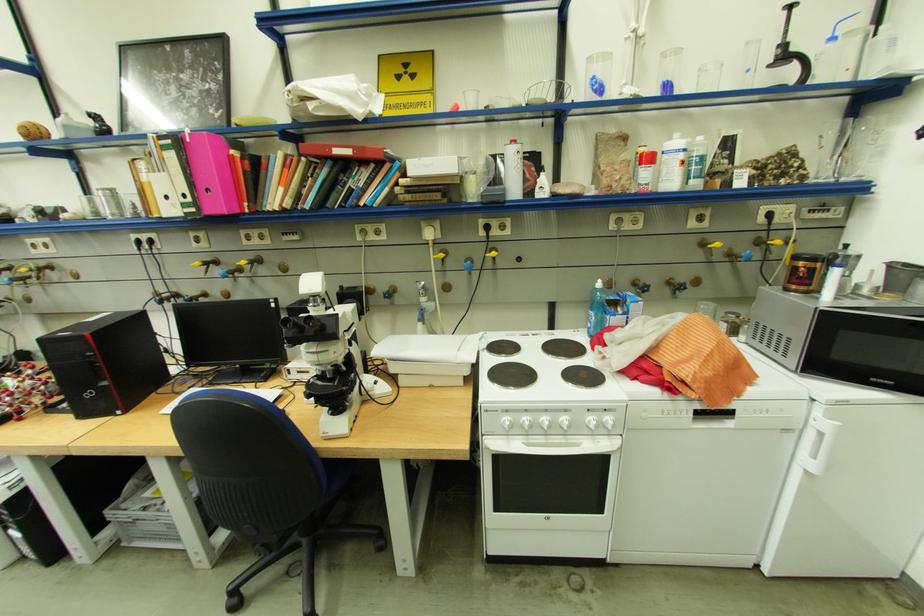
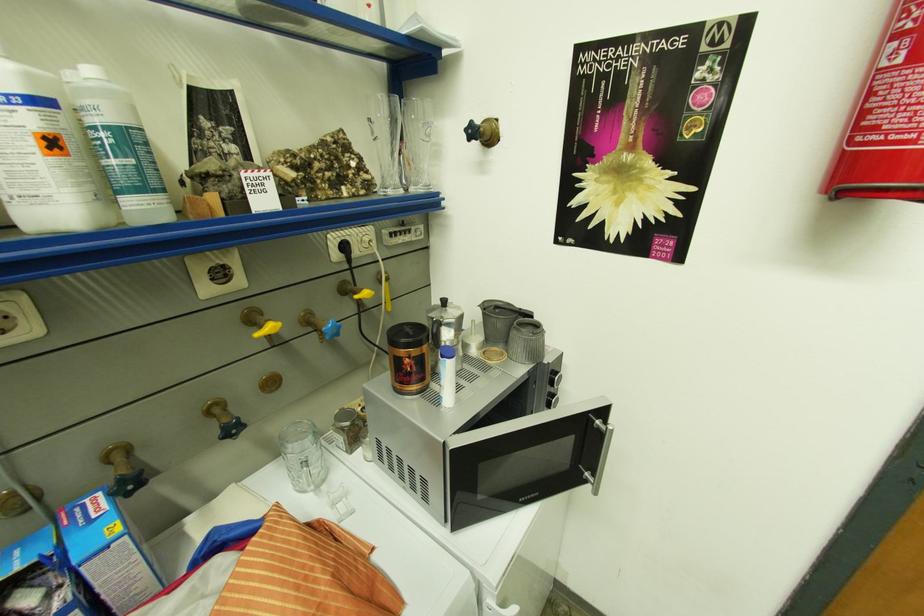
Where in the second image is the point corresponding to point 622,288 from the first image?

(42, 509)